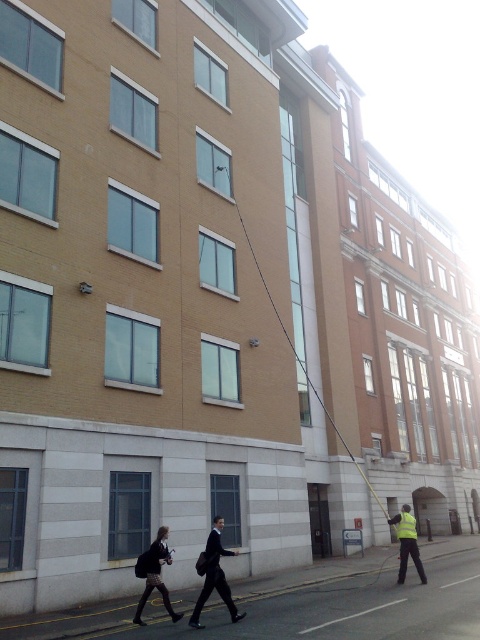
Question: Can you confirm if dark suit at center is positioned to the right of dark gray skirt at lower left?

Choices:
 (A) no
 (B) yes

Answer: (B)

Question: Among these objects, which one is nearest to the camera?

Choices:
 (A) dark gray skirt at lower left
 (B) reflective yellow vest at lower right

Answer: (A)

Question: Is dark suit at center bigger than reflective yellow vest at lower right?

Choices:
 (A) yes
 (B) no

Answer: (B)

Question: Which point is closer to the camera taking this photo?

Choices:
 (A) (140, 611)
 (B) (215, 536)
 (C) (416, 528)

Answer: (A)

Question: Can you confirm if dark gray skirt at lower left is wider than reflective yellow vest at lower right?

Choices:
 (A) no
 (B) yes

Answer: (A)

Question: Which of the following is the farthest from the observer?

Choices:
 (A) (157, 561)
 (B) (416, 566)
 (C) (202, 598)

Answer: (B)